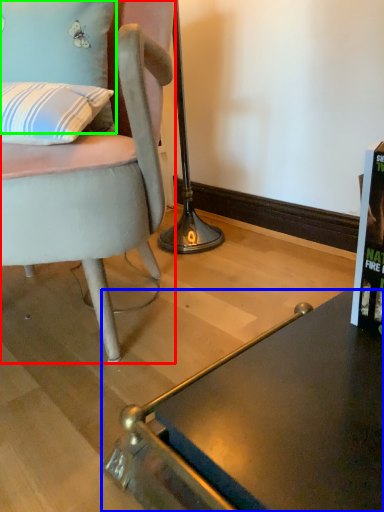
Question: Which is farther away from chair (highlighted by a red box)? desk (highlighted by a blue box) or pillow (highlighted by a green box)?

Choices:
 (A) desk
 (B) pillow

Answer: (A)